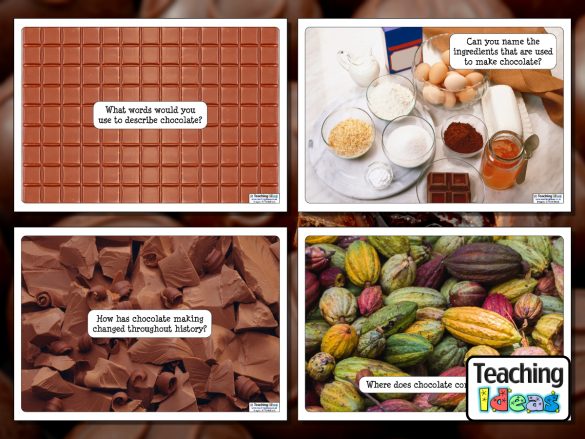
This screenshot has width=585, height=439. What are the coordinates of `butter dish` in the screenshot? It's located at (495, 111).